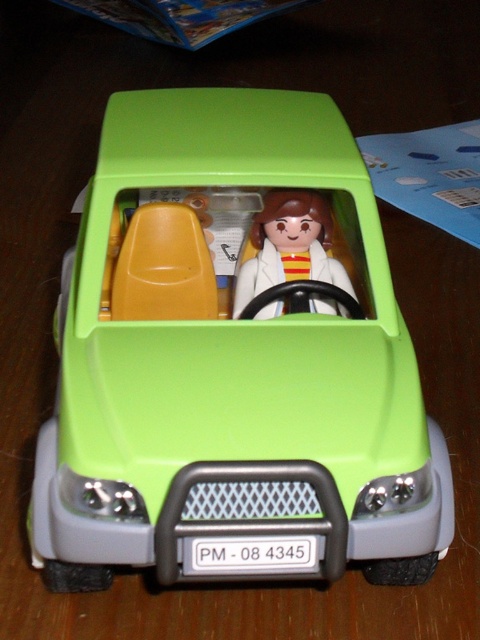
In the scene shown: Does lime matte toy car at center have a larger size compared to matte plastic figure at center?

Indeed, lime matte toy car at center has a larger size compared to matte plastic figure at center.

Measure the distance between lime matte toy car at center and matte plastic figure at center.

The distance of lime matte toy car at center from matte plastic figure at center is 6.38 inches.

Locate an element on the screen. This screenshot has height=640, width=480. lime matte toy car at center is located at coordinates (233, 362).

Identify the location of lime matte toy car at center. (233, 362).